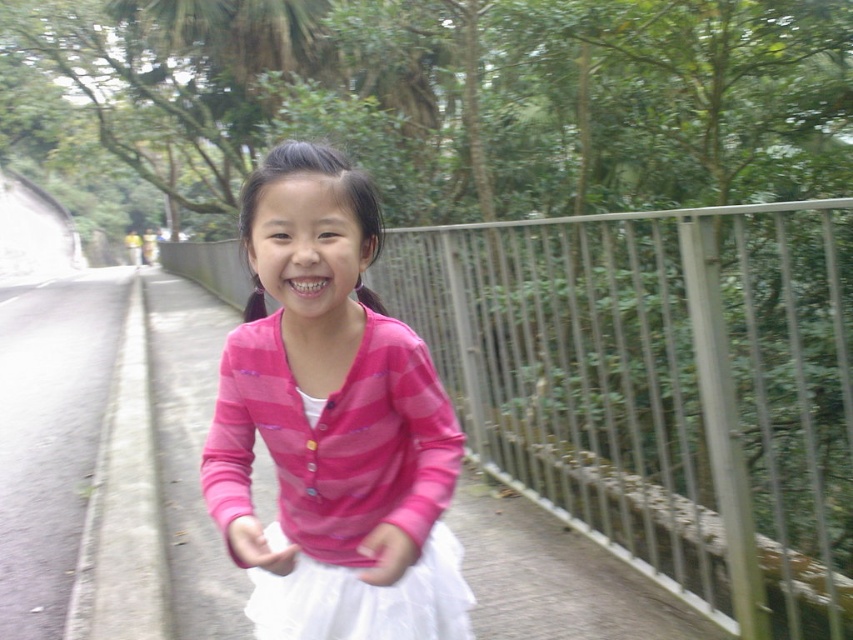
Who is more distant from viewer, (825,444) or (332,301)?

Point (825,444)

Which is in front, point (735, 557) or point (277, 502)?

Positioned in front is point (277, 502).

Is point (689, 448) in front of point (318, 348)?

No, it is behind (318, 348).

Identify the location of metallic gray rail at center. (660, 388).